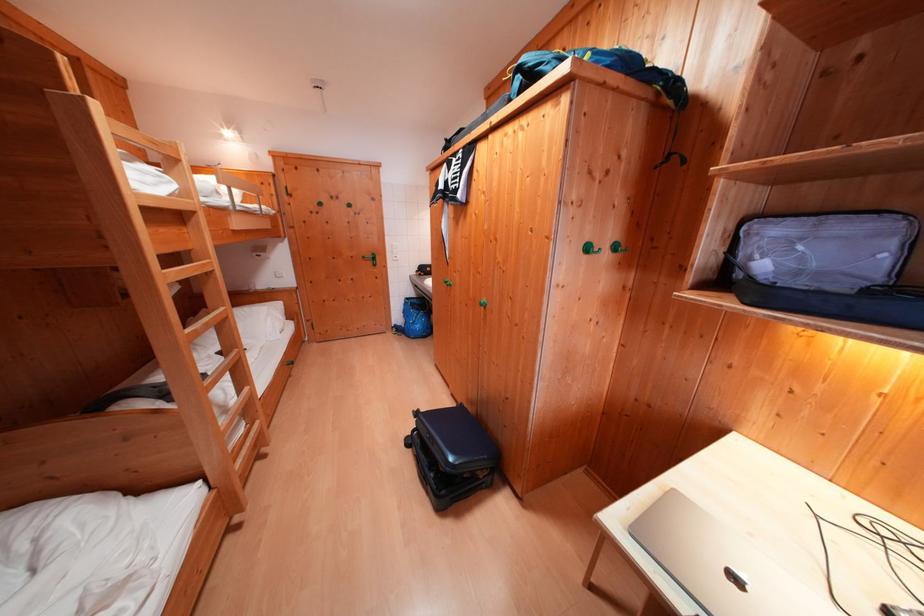
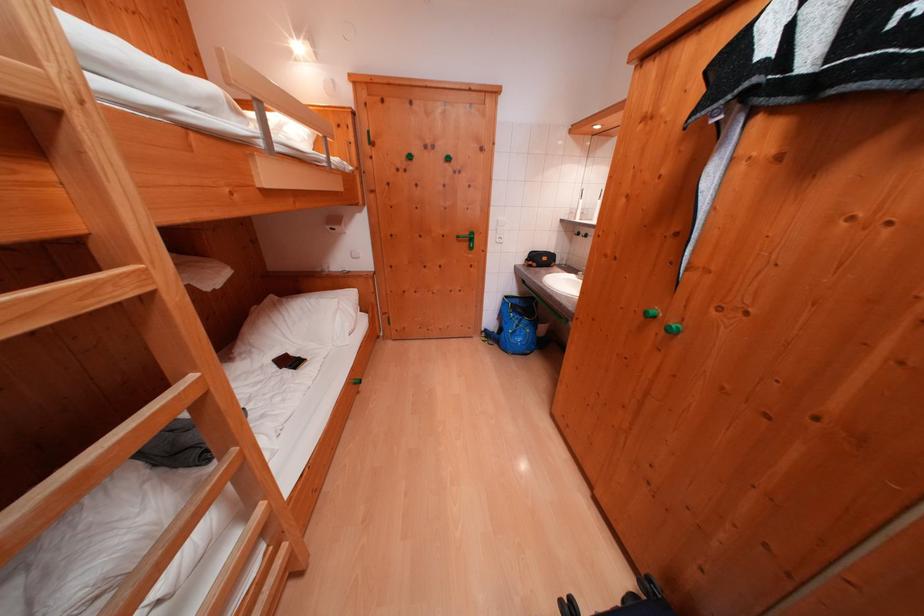
Where in the second image is the point corresponding to (371,262) from the first image?

(466, 241)